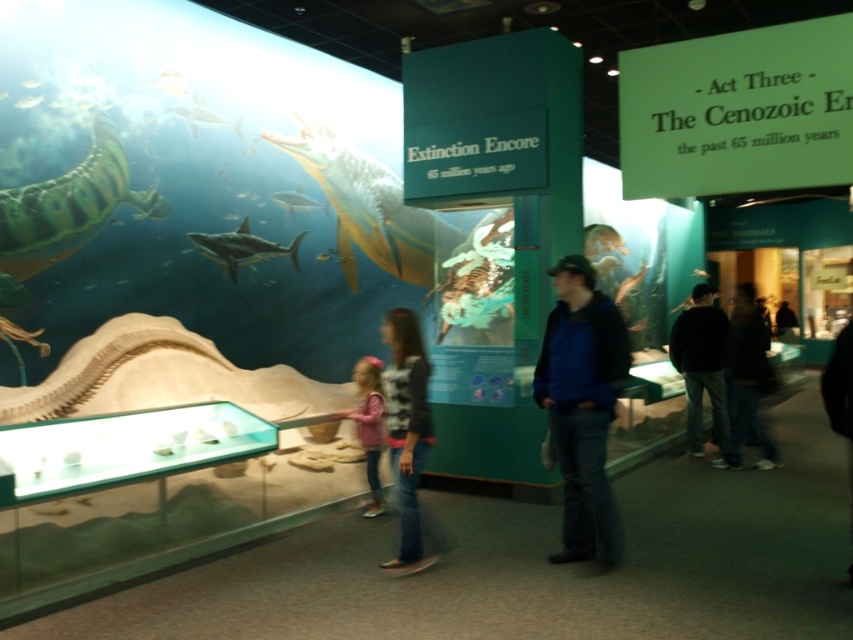
Is denim jeans at center below dark blue jeans at lower right?

Correct, denim jeans at center is located below dark blue jeans at lower right.

Does denim jeans at center lie in front of dark blue jeans at lower right?

That is True.

You are a GUI agent. You are given a task and a screenshot of the screen. Output one action in this format:
    pyautogui.click(x=<x>, y=<y>)
    Task: Click on the denim jeans at center
    The height and width of the screenshot is (640, 853).
    Given the screenshot: What is the action you would take?
    pyautogui.click(x=405, y=428)

The width and height of the screenshot is (853, 640). In order to click on denim jeans at center in this screenshot , I will do `click(405, 428)`.

Who is taller, blue denim jacket at center or shiny silver shark at center?

With more height is blue denim jacket at center.

Who is more distant from viewer, (566, 284) or (227, 268)?

The point (227, 268) is more distant.

In order to click on blue denim jacket at center in this screenshot , I will do `click(582, 404)`.

Is point (82, 186) closer to camera compared to point (299, 189)?

Yes, it is.

Is green matte fish at upper left taller than shiny silver shark at upper center?

Indeed, green matte fish at upper left has a greater height compared to shiny silver shark at upper center.

Where is `green matte fish at upper left`? green matte fish at upper left is located at coordinates (70, 204).